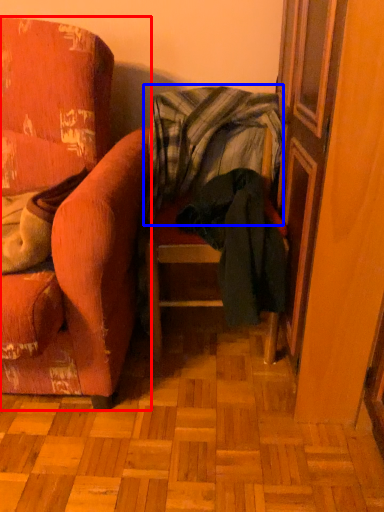
Question: Which object appears farthest to the camera in this image, chair (highlighted by a red box) or blanket (highlighted by a blue box)?

Choices:
 (A) chair
 (B) blanket

Answer: (B)